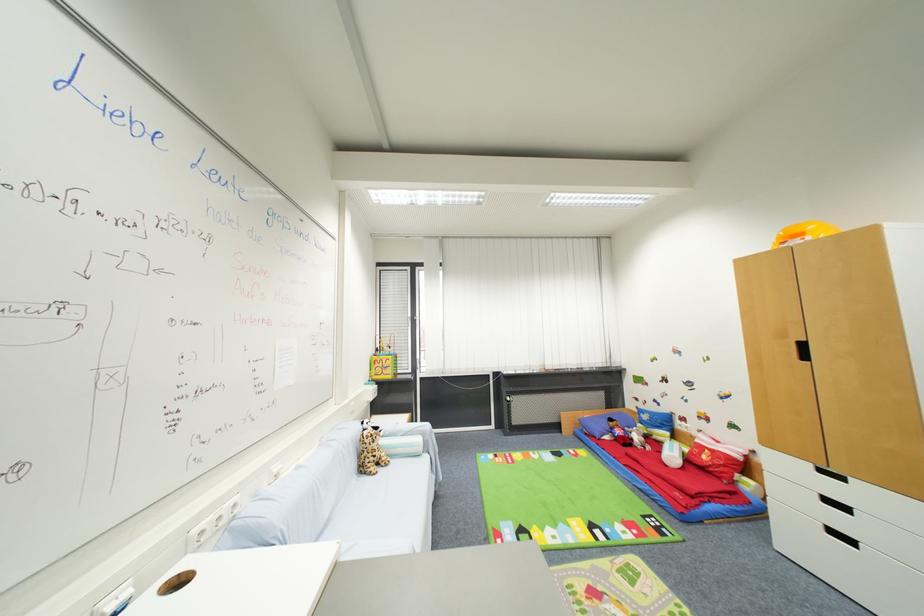
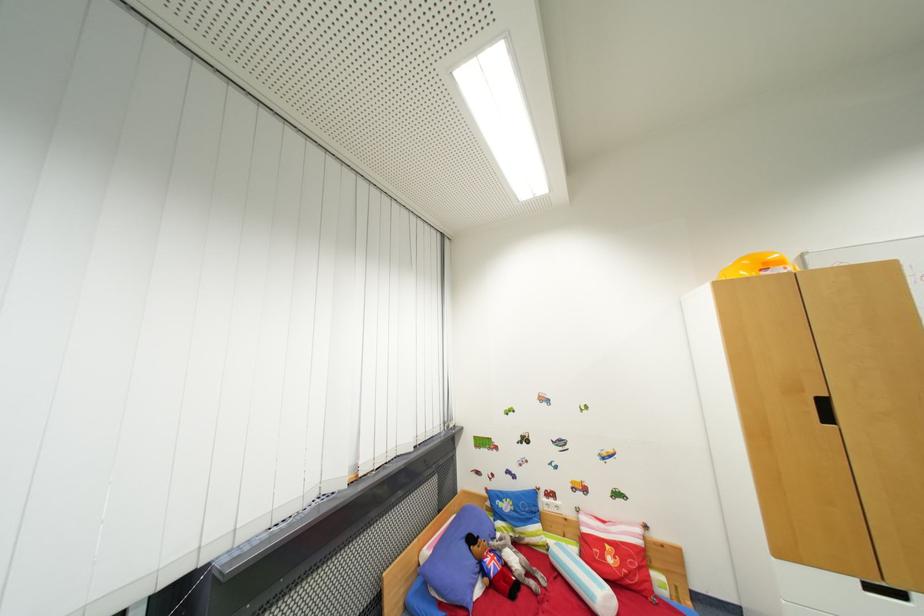
Locate, in the second image, the point that corresponds to [810,359] in the first image.

(833, 419)